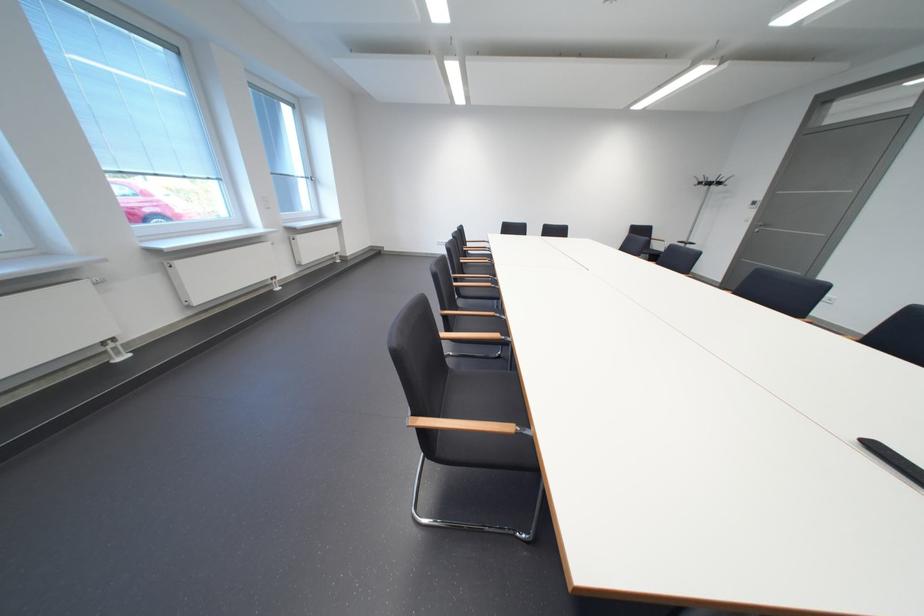
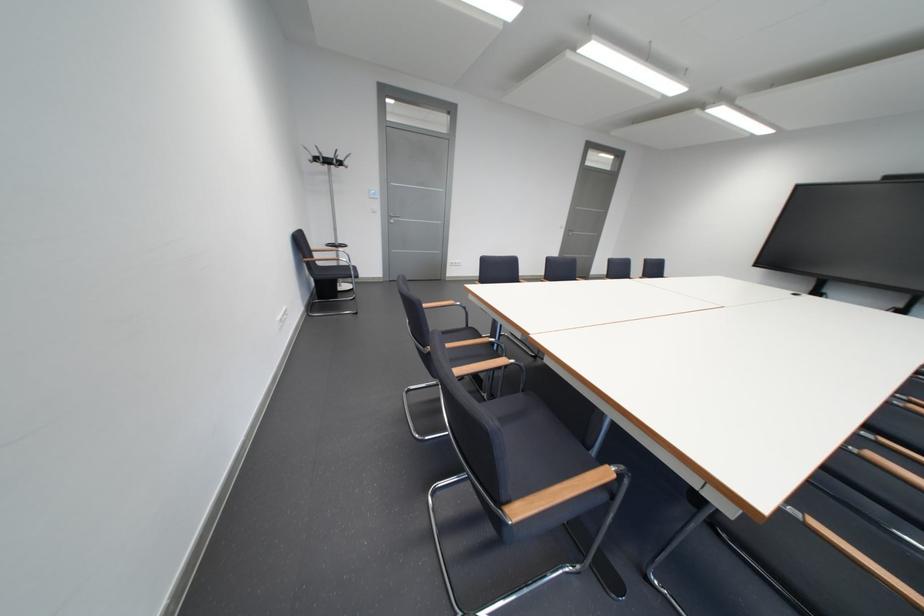
In the second image, find the point that corresponds to the point at 715,185 in the first image.

(330, 161)